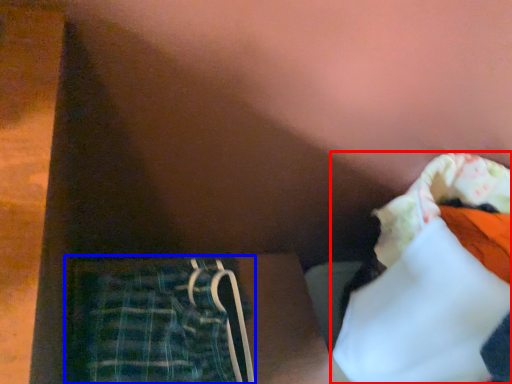
Question: Which object appears farthest to the camera in this image, clothing (highlighted by a red box) or trousers (highlighted by a blue box)?

Choices:
 (A) clothing
 (B) trousers

Answer: (B)